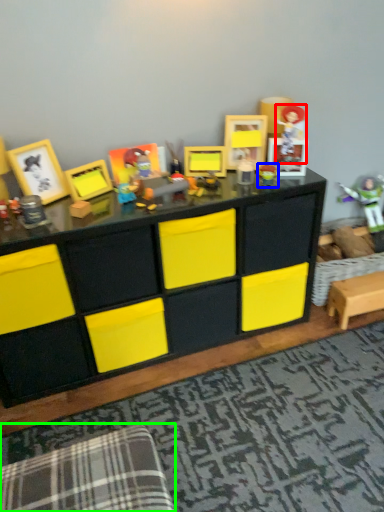
Question: Which object is the closest to the toy (highlighted by a red box)? Choose among these: toy (highlighted by a blue box) or swivel chair (highlighted by a green box).

Choices:
 (A) toy
 (B) swivel chair

Answer: (A)